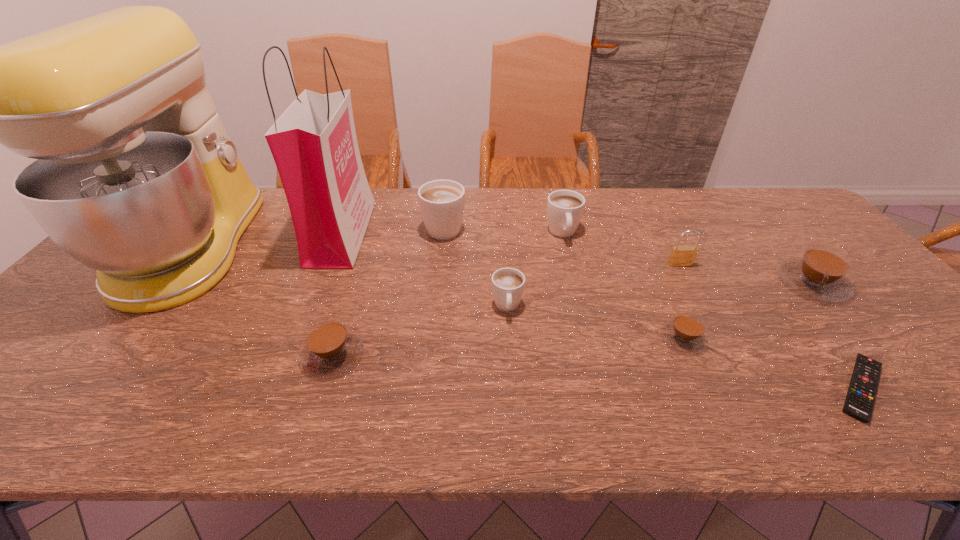
Identify the location of the third cappuccino from left to right. The width and height of the screenshot is (960, 540). (508, 284).

Find the location of a particular element. The image size is (960, 540). the second smallest brown cappuccino is located at coordinates (330, 348).

The height and width of the screenshot is (540, 960). I want to click on the leftmost brown cappuccino, so click(x=330, y=348).

Identify the location of the second brown cappuccino from right to left. The image size is (960, 540). (686, 332).

Where is `the shortest cappuccino`? This screenshot has height=540, width=960. the shortest cappuccino is located at coordinates (686, 332).

I want to click on the shortest object, so click(x=859, y=402).

This screenshot has height=540, width=960. In order to click on free space located 0.400m on the side of the mixer with the control knob in this screenshot , I will do `click(387, 246)`.

I want to click on free space located 0.110m on the front-facing side of the pink shopping bag, so click(x=401, y=233).

Locate an element on the screen. The image size is (960, 540). free location located with the handle on the side of the third tallest object is located at coordinates (448, 190).

Find the location of `free space located with the handle on the side of the third tallest object`. free space located with the handle on the side of the third tallest object is located at coordinates (448, 188).